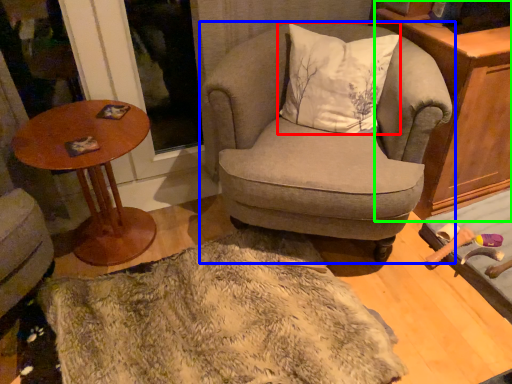
Question: Which object is the farthest from pillow (highlighted by a red box)? Choose among these: chair (highlighted by a blue box) or cabinetry (highlighted by a green box).

Choices:
 (A) chair
 (B) cabinetry

Answer: (B)